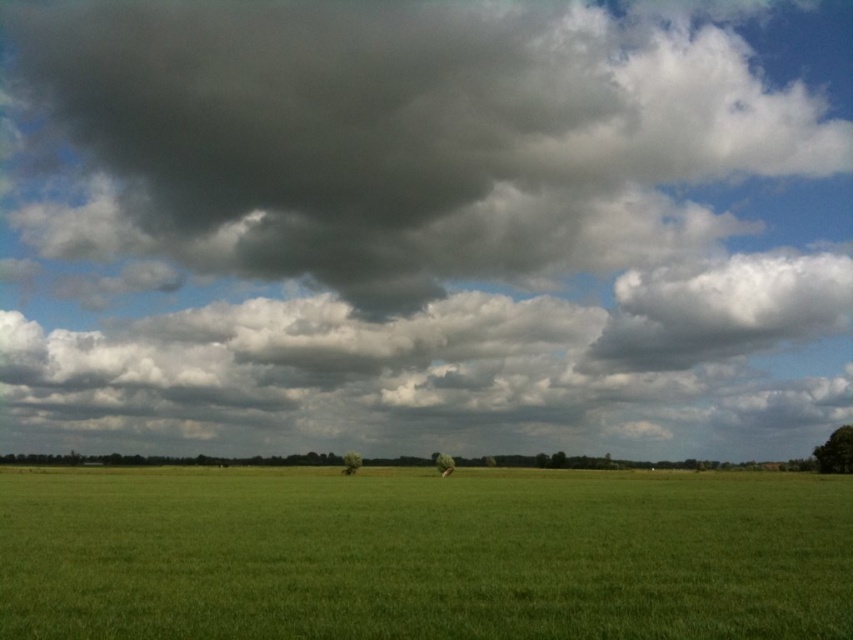
Between dark gray cloud at upper center and green grass at center, which one appears on the right side from the viewer's perspective?

green grass at center

This screenshot has width=853, height=640. Identify the location of dark gray cloud at upper center. (403, 134).

Identify the location of dark gray cloud at upper center. This screenshot has width=853, height=640. (403, 134).

The width and height of the screenshot is (853, 640). Find the location of `dark gray cloud at upper center`. dark gray cloud at upper center is located at coordinates (403, 134).

Between point (398, 584) and point (677, 321), which one is positioned behind?

Positioned behind is point (677, 321).

Can you confirm if green grass at center is bigger than white fluffy cloud at upper right?

Yes, green grass at center is bigger than white fluffy cloud at upper right.

Locate an element on the screen. This screenshot has height=640, width=853. green grass at center is located at coordinates (422, 554).

Who is lower down, dark gray cloud at upper center or white fluffy cloud at upper right?

white fluffy cloud at upper right is lower down.

Between point (741, 170) and point (822, 328), which one is positioned in front?

Point (822, 328) is more forward.

I want to click on dark gray cloud at upper center, so tap(403, 134).